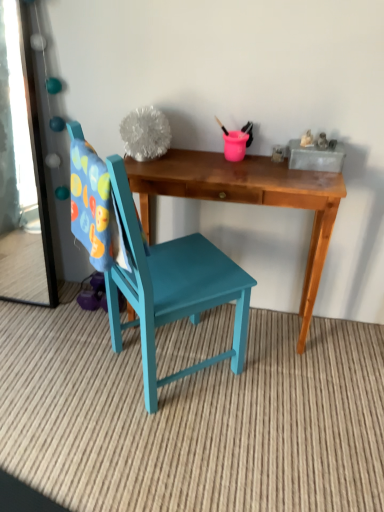
Where is `free area below teal painted wood chair at center (from a real-world perspective)`? Image resolution: width=384 pixels, height=512 pixels. free area below teal painted wood chair at center (from a real-world perspective) is located at coordinates (165, 362).